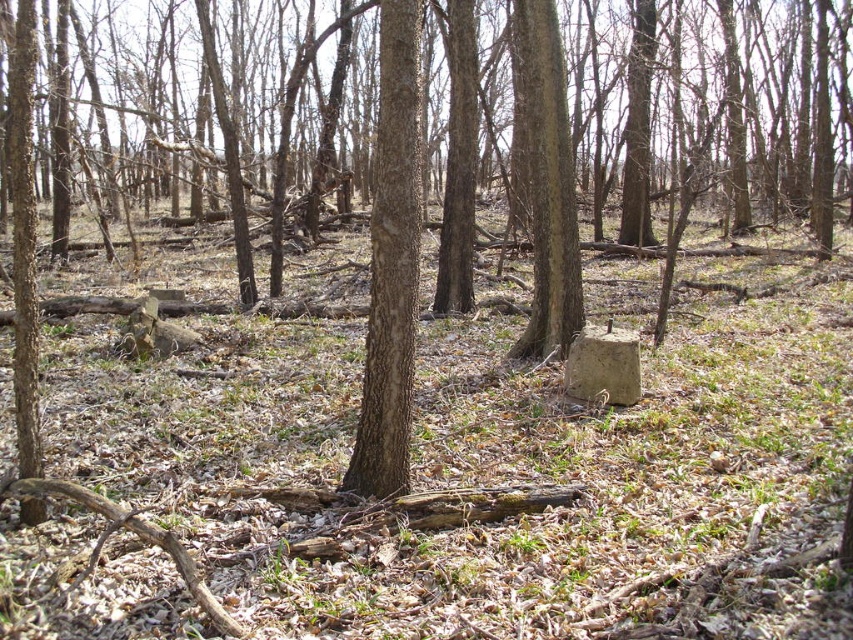
You are an environmental scientist studying tree growth in this forest. You notice the brown rough bark tree trunk at center and the brown rough bark tree at lower left. Which of these two trees has a smaller diameter?

The brown rough bark tree trunk at center has a smaller size compared to the brown rough bark tree at lower left, so it has a smaller diameter.

You are standing at the edge of the forest and see the brown rough bark tree trunk at center and the rough bark tree at center. Which one is closer to you?

The brown rough bark tree trunk at center is closer to you than the rough bark tree at center since it is only 3.39 meters away.

You are a hiker trying to navigate through the woods. You see two trees in front of you, the brown rough bark tree trunk at center and the rough bark tree at center. Which one is more to the left?

The brown rough bark tree trunk at center is positioned on the left side of the rough bark tree at center, so it is more to the left.